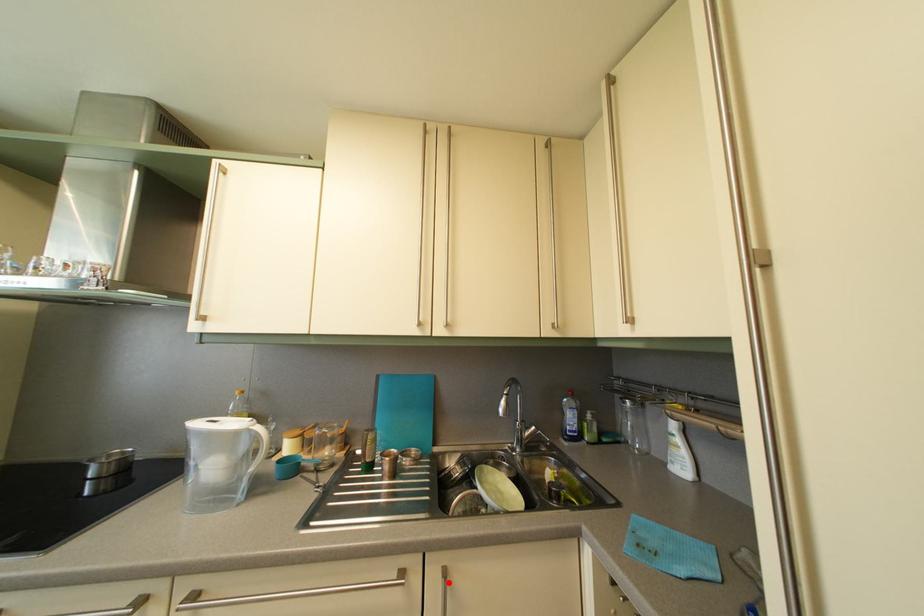
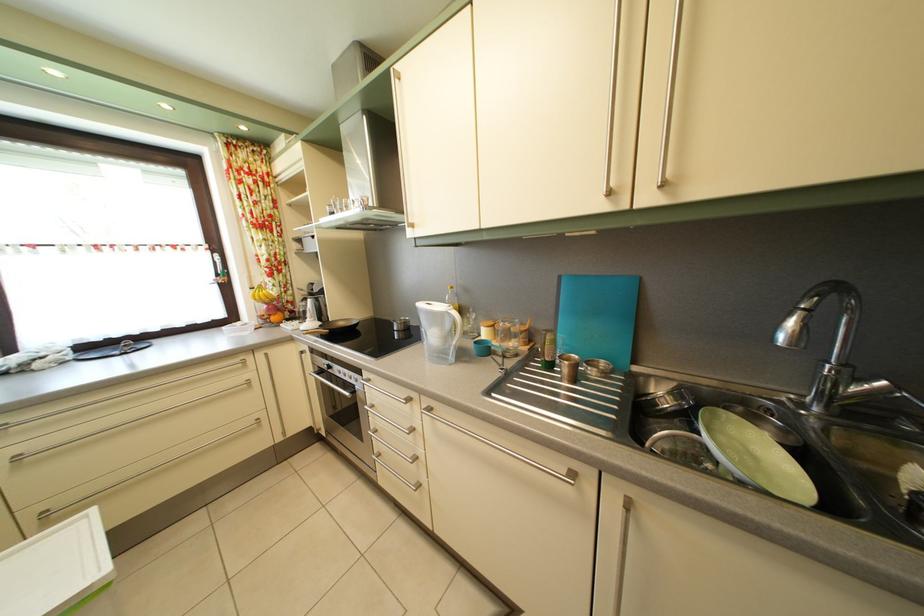
Locate, in the second image, the point that corresponds to the highlighted location in the first image.

(629, 509)